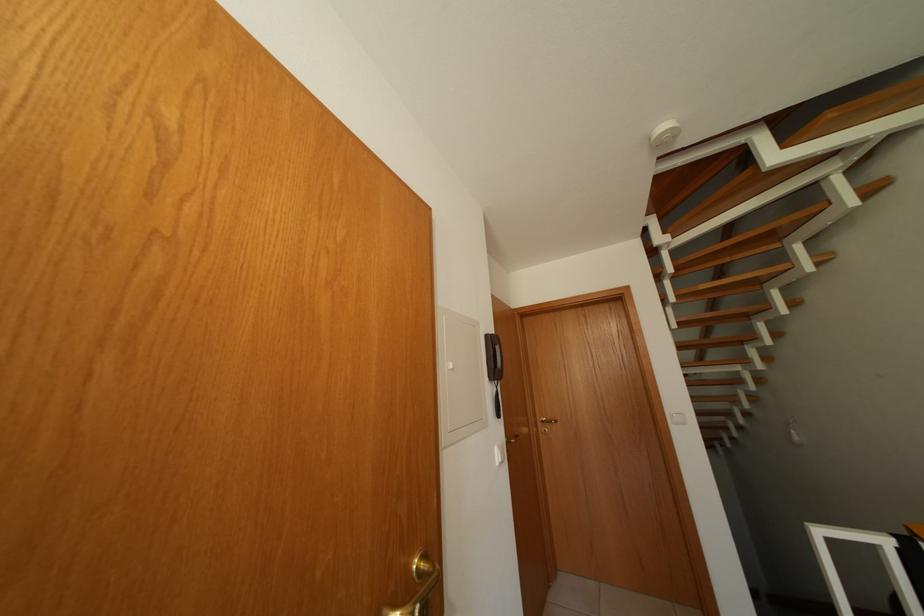
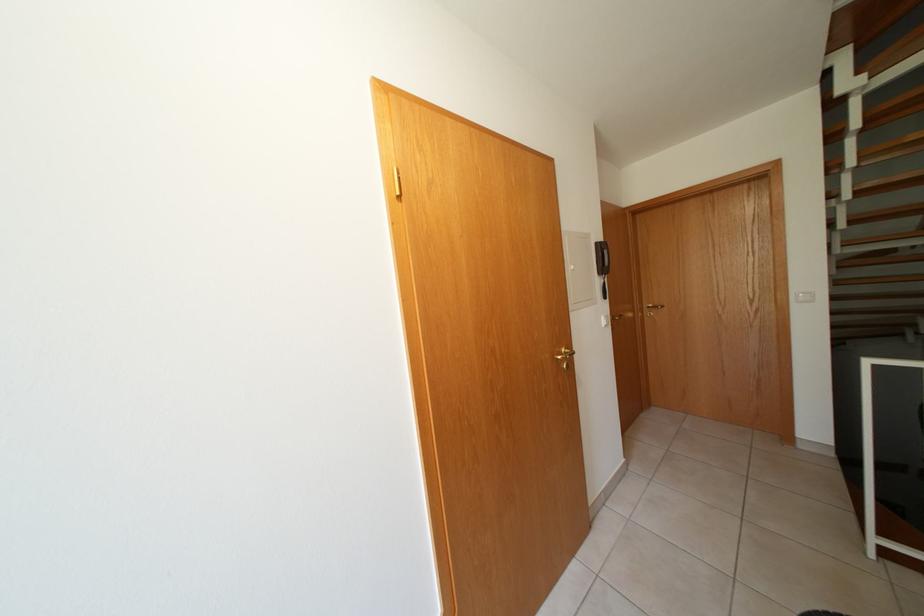
Where in the second image is the point corresponding to the point at 505,454 from the first image?

(611, 323)